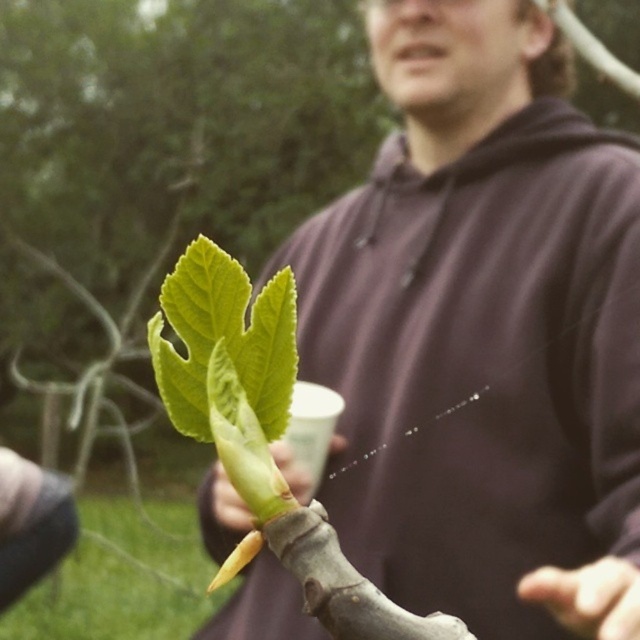
Question: Does green matte leaf at center appear under green leafy branch at center?

Choices:
 (A) yes
 (B) no

Answer: (B)

Question: Is brown matte hoodie at center further to the viewer compared to green leafy branch at center?

Choices:
 (A) no
 (B) yes

Answer: (A)

Question: Can you confirm if green matte leaf at center is positioned to the right of green leafy branch at center?

Choices:
 (A) no
 (B) yes

Answer: (B)

Question: Which of the following is the farthest from the observer?

Choices:
 (A) (205, 353)
 (B) (227, 481)
 (C) (396, 58)

Answer: (C)

Question: Estimate the real-world distances between objects in this image. Which object is farther from the green matte leaf at center?

Choices:
 (A) green leafy branch at center
 (B) brown matte hoodie at center

Answer: (B)

Question: Which object is the farthest from the brown matte hoodie at center?

Choices:
 (A) green leafy branch at center
 (B) green matte leaf at center

Answer: (B)